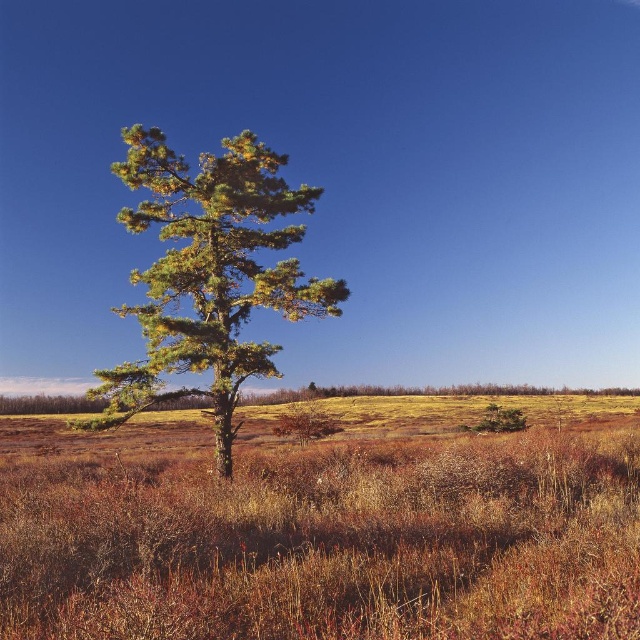
You are standing at the base of the pine tree in the center of the landscape. You see two points marked in the image. Which point, point (525, 506) or point (120, 308), is closer to you?

Point (525, 506) is in front of point (120, 308), so it is closer to you.